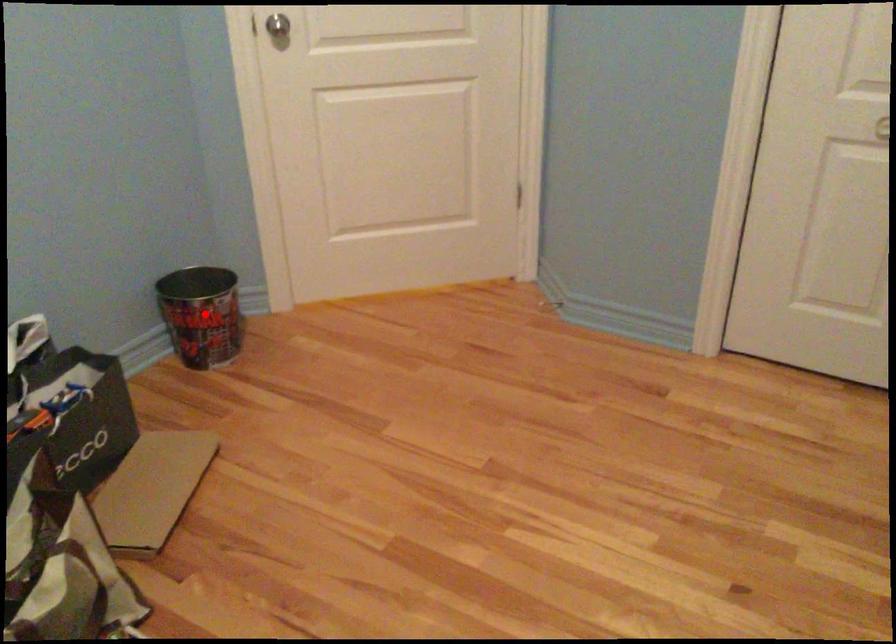
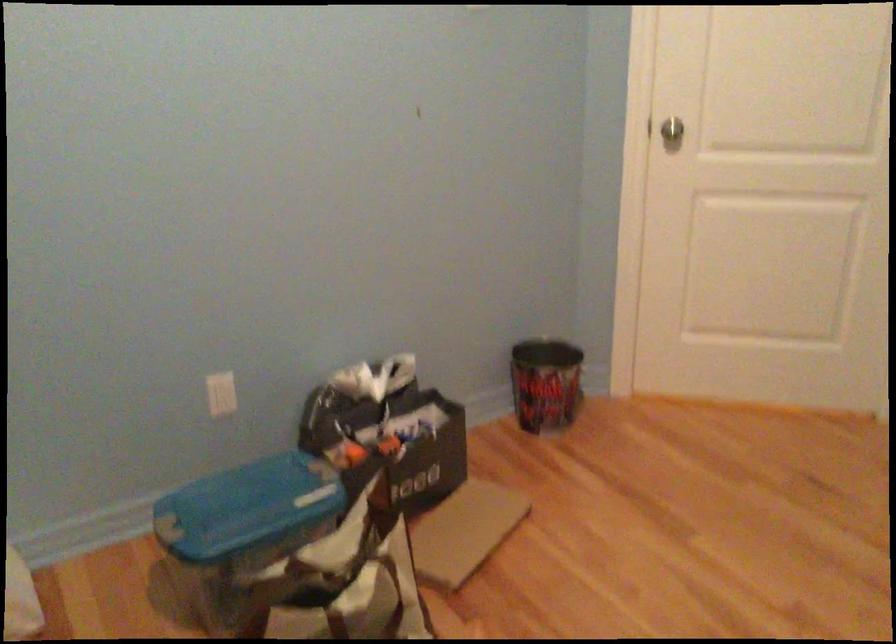
Find the pixel in the second image that matches the highlighted location in the first image.

(545, 383)